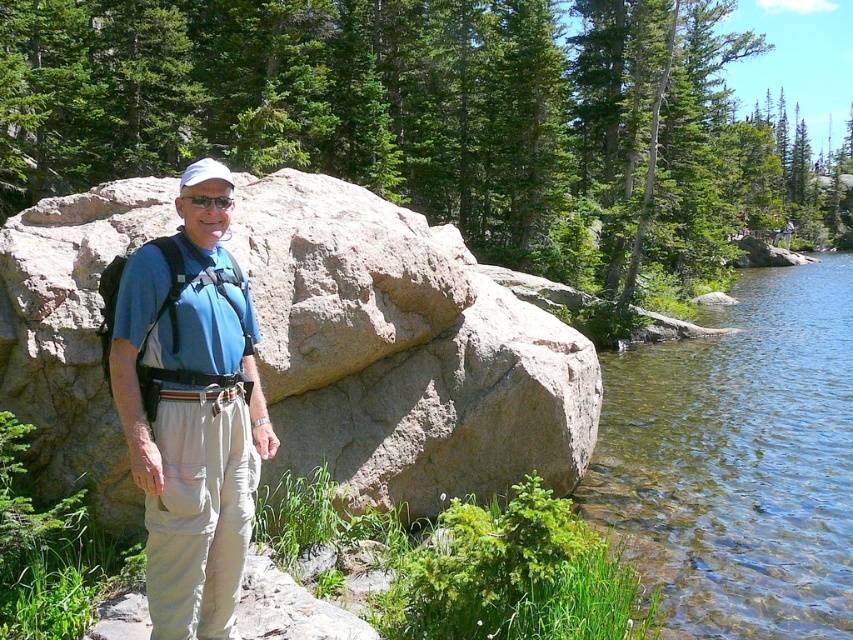
Question: Which object is positioned farthest from the brown rough rock at center?

Choices:
 (A) matte black goggles at center
 (B) blue fabric shirt at center
 (C) clear water at lower right

Answer: (C)

Question: Which is farther from the clear water at lower right?

Choices:
 (A) brown rough rock at center
 (B) blue fabric shirt at center
 (C) matte black goggles at center

Answer: (C)

Question: Can you confirm if clear water at lower right is positioned to the right of matte black goggles at center?

Choices:
 (A) yes
 (B) no

Answer: (A)

Question: Where is blue fabric shirt at center located in relation to matte black goggles at center in the image?

Choices:
 (A) right
 (B) left

Answer: (A)

Question: Can you confirm if clear water at lower right is thinner than blue fabric shirt at center?

Choices:
 (A) no
 (B) yes

Answer: (A)

Question: Which point appears farthest from the camera in this image?

Choices:
 (A) (821, 548)
 (B) (202, 204)
 (C) (183, 234)
 (D) (343, 314)

Answer: (A)